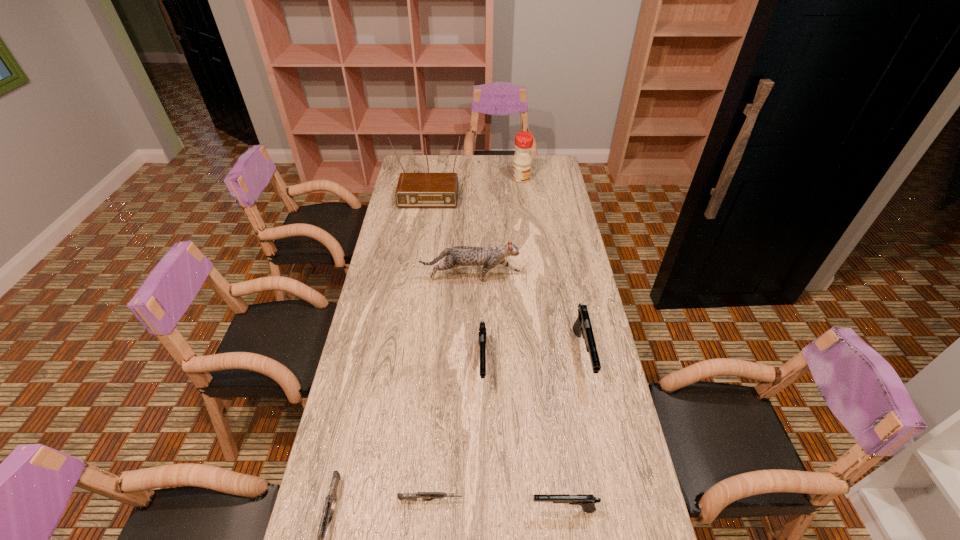
This screenshot has height=540, width=960. Identify the location of vacant space situated 0.270m aimed along the barrel of the shortest object. (568, 500).

The image size is (960, 540). I want to click on radio_receiver positioned at the far edge, so [x=414, y=190].

Where is `condiment that is positioned at the far edge`? The image size is (960, 540). condiment that is positioned at the far edge is located at coordinates (522, 159).

Find the location of a particular element. object located at the left edge is located at coordinates (414, 190).

You are a GUI agent. You are given a task and a screenshot of the screen. Output one action in this format:
    pyautogui.click(x=<x>, y=<y>)
    Task: Click on the condiment that is at the right edge
    This screenshot has width=960, height=540.
    Given the screenshot: What is the action you would take?
    pyautogui.click(x=522, y=159)

Image resolution: width=960 pixels, height=540 pixels. In order to click on object that is at the far left corner in this screenshot , I will do `click(414, 190)`.

Find the location of a particular element. This screenshot has height=540, width=960. object located in the far right corner section of the desktop is located at coordinates (522, 159).

Identify the location of free space at the far edge. (481, 177).

Identify the location of vacant region at the left edge of the desktop. (378, 337).

Where is `vacant space at the right edge of the desktop`? This screenshot has height=540, width=960. vacant space at the right edge of the desktop is located at coordinates (596, 474).